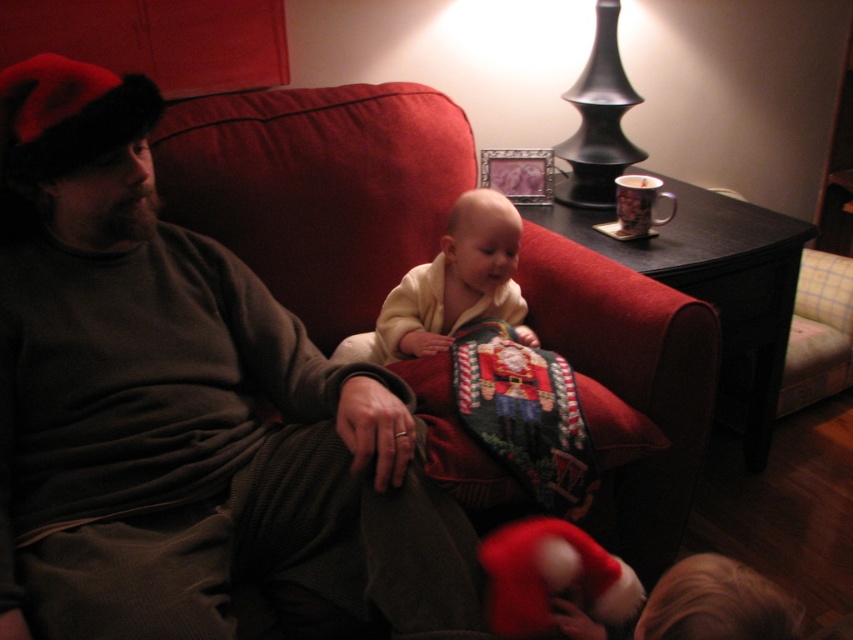
Can you confirm if dark brown sweater at left is taller than velvet cushion at center?

No, dark brown sweater at left is not taller than velvet cushion at center.

Between dark brown sweater at left and velvet cushion at center, which one appears on the right side from the viewer's perspective?

From the viewer's perspective, velvet cushion at center appears more on the right side.

Locate an element on the screen. Image resolution: width=853 pixels, height=640 pixels. dark brown sweater at left is located at coordinates pos(178,392).

What do you see at coordinates (178, 392) in the screenshot?
I see `dark brown sweater at left` at bounding box center [178, 392].

Is dark brown sweater at left positioned before soft cream sweater at center?

Yes, it is.

Does point (206, 269) come closer to viewer compared to point (509, 321)?

Yes, point (206, 269) is closer to viewer.

The image size is (853, 640). Find the location of `dark brown sweater at left`. dark brown sweater at left is located at coordinates (178, 392).

Is velvet cushion at center smaller than soft cream sweater at center?

No, velvet cushion at center is not smaller than soft cream sweater at center.

Does velvet cushion at center lie in front of soft cream sweater at center?

Yes, velvet cushion at center is in front of soft cream sweater at center.

Between point (357, 305) and point (416, 275), which one is positioned in front?

Positioned in front is point (416, 275).

The height and width of the screenshot is (640, 853). I want to click on velvet cushion at center, so click(x=318, y=188).